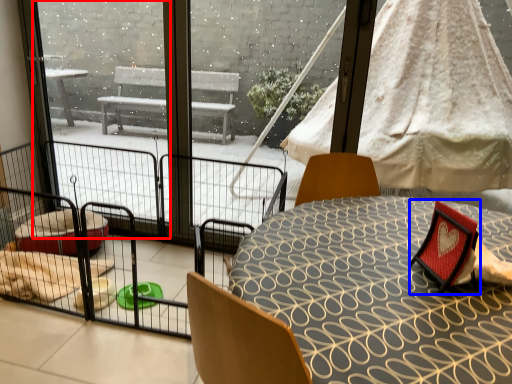
Question: Among these objects, which one is farthest to the camera, window screen (highlighted by a red box) or armchair (highlighted by a blue box)?

Choices:
 (A) window screen
 (B) armchair

Answer: (A)